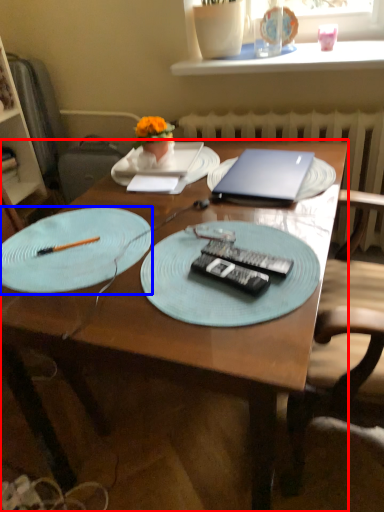
Question: Which point is closer to the camera, desk (highlighted by a red box) or plate (highlighted by a blue box)?

Choices:
 (A) desk
 (B) plate

Answer: (A)